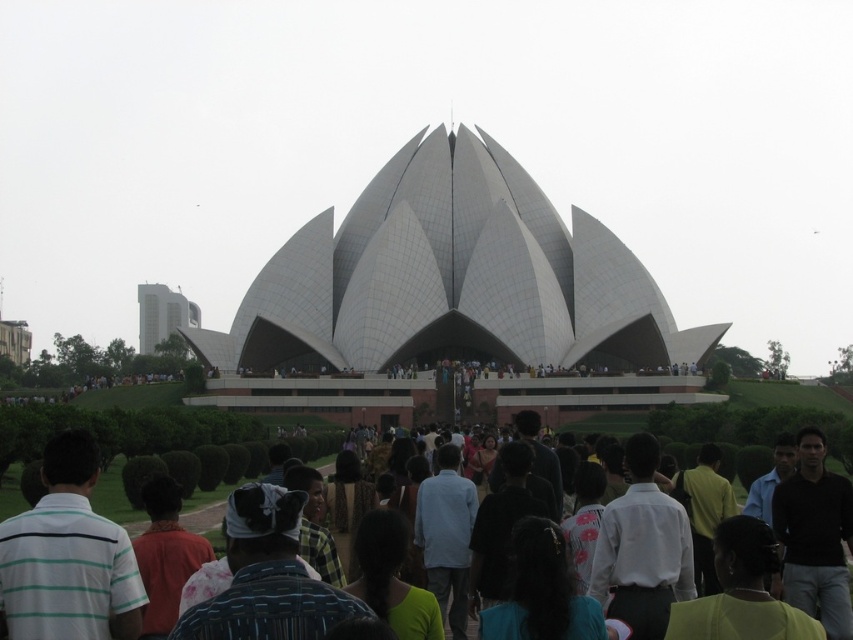
You are a photographer standing in front of the Lotus Temple. You want to take a photo that includes both the white smooth dome at center and the white shirt at center. Which object should you zoom in on to ensure both are clearly visible in the frame?

To ensure both the white smooth dome at center and the white shirt at center are clearly visible, you should zoom in on the white shirt at center since it is smaller than the dome, allowing both objects to fit within the frame.

You are standing in front of the Lotus Temple in New Delhi. You want to take a photo of the white smooth dome at center. If your camera can focus on objects up to 100 meters away, will you be able to capture the dome clearly?

The white smooth dome at center is 137.69 meters from viewer. Since the camera can only focus up to 100 meters, you will not be able to capture the dome clearly.

In the scene shown: You are standing in front of the Lotus Temple and notice a white smooth dome at center and a white shirt at center. Which object is wider?

The white shirt at center is wider than the white smooth dome at center.